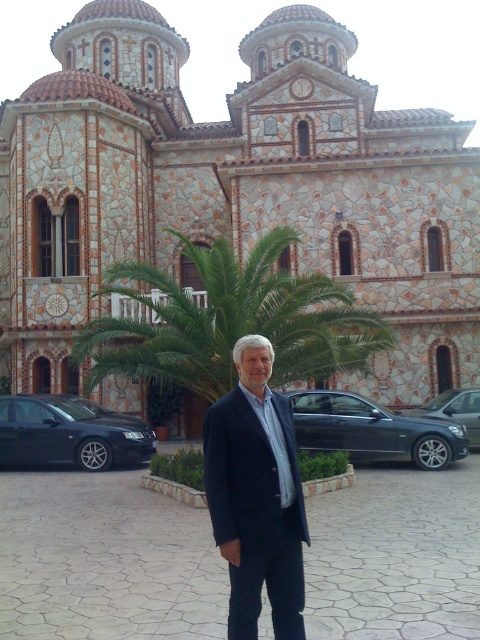
You are a photographer planning to capture a wide shot of the scene. You want to include both the green leafy palm tree at center and the sleek metallic sedan at center in your frame. What is the minimum distance you should position yourself from the closest object to ensure both are fully visible?

The green leafy palm tree at center and the sleek metallic sedan at center are 12.49 meters apart. To include both in the frame, you should position yourself at least 12.49 meters away from the closest object.